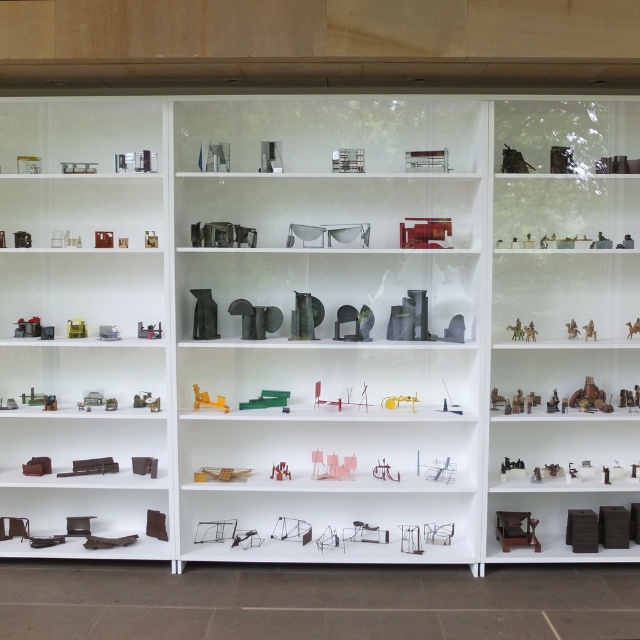
Who is shorter, wooden horse at right or metallic gold camel at center?

Standing shorter between the two is wooden horse at right.

The height and width of the screenshot is (640, 640). In order to click on wooden horse at right in this screenshot , I will do `click(589, 330)`.

Which of these two, metallic sculpture at center or metallic gold camel at center, stands taller?

metallic sculpture at center is taller.

Does point (417, 262) lie behind point (637, 326)?

That is True.

Locate an element on the screen. metallic sculpture at center is located at coordinates (326, 282).

Is brown matte furniture at lower left to the right of metallic gold horse at right from the viewer's perspective?

In fact, brown matte furniture at lower left is to the left of metallic gold horse at right.

Who is more forward, (128, 464) or (509, 326)?

Point (509, 326) is more forward.

Where is `brown matte furniture at lower left`? brown matte furniture at lower left is located at coordinates (81, 310).